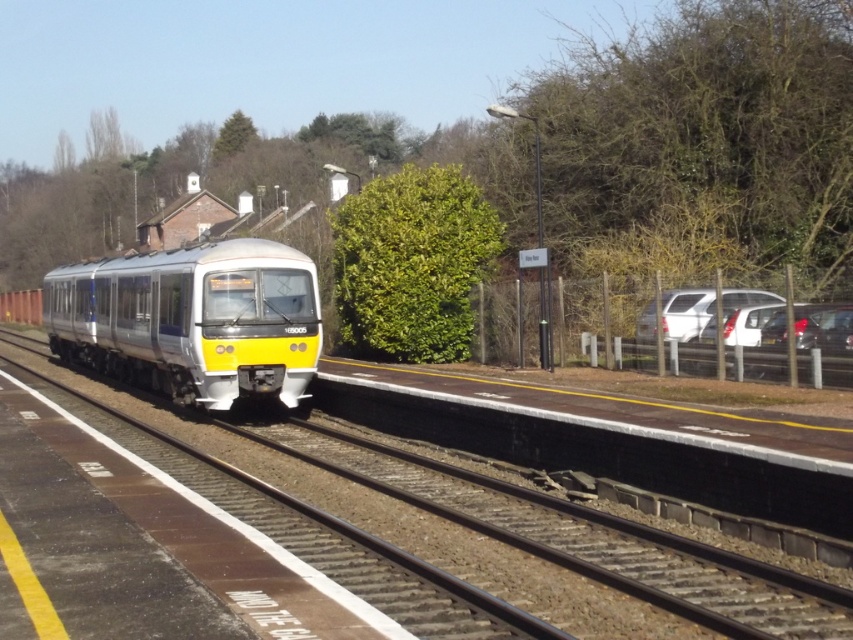
Who is shorter, silver metallic train at center or smooth metal train track at center?

Standing shorter between the two is smooth metal train track at center.

Is the position of silver metallic train at center more distant than that of smooth metal train track at center?

Yes, it is.

Image resolution: width=853 pixels, height=640 pixels. Describe the element at coordinates (193, 320) in the screenshot. I see `silver metallic train at center` at that location.

Find the location of a particular element. The image size is (853, 640). silver metallic train at center is located at coordinates (193, 320).